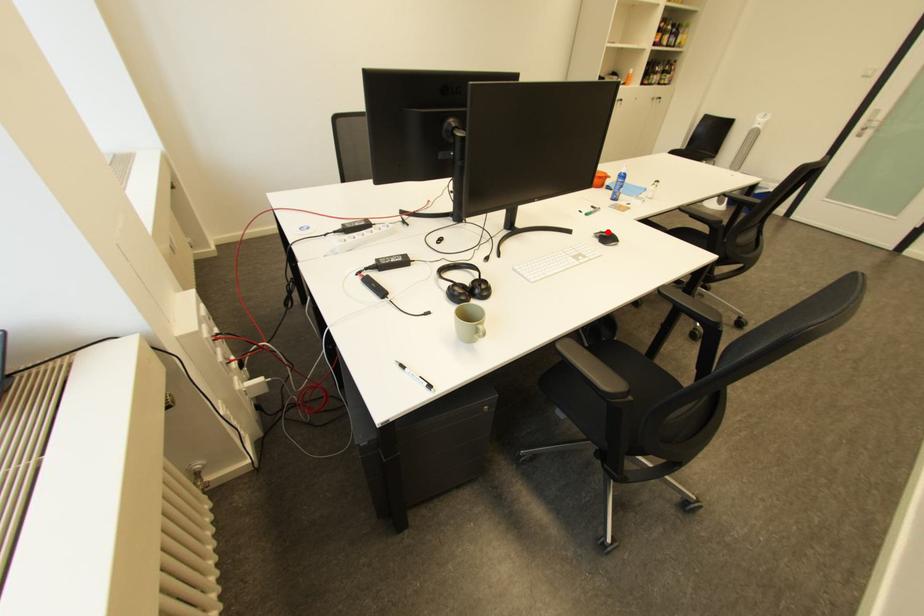
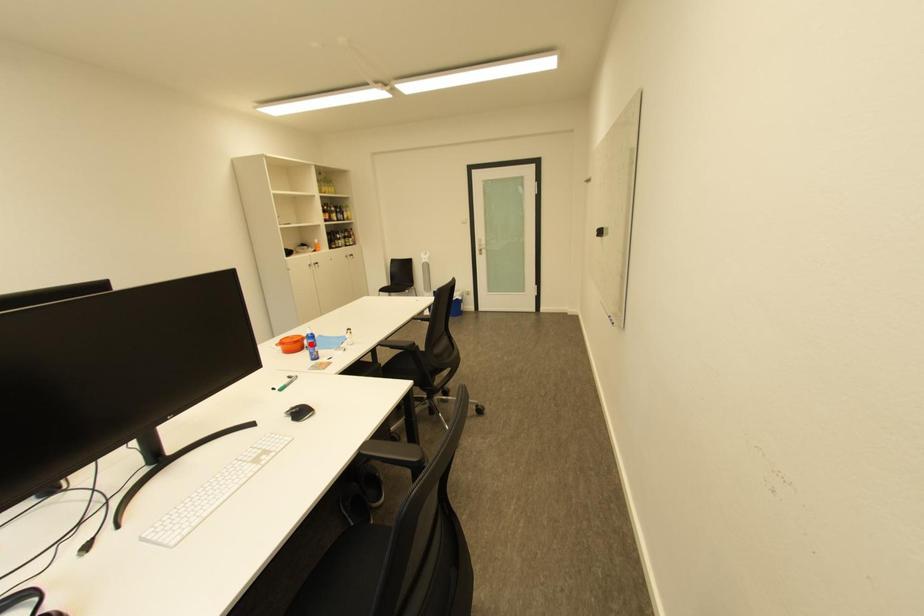
In the scene shown: I am providing you with two images of the same scene from different viewpoints. A red point is marked on the first image and another point is marked on the second image. Is the red point in image1 aligned with the point shown in image2?

No